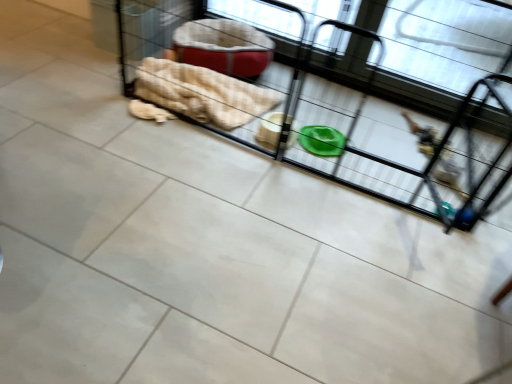
At what (x,y) coordinates should I click in order to perform the action: click on green plastic bowl at center. Please return your answer as a coordinate pair (x, y). This screenshot has height=384, width=512. Looking at the image, I should click on (351, 111).

Describe the element at coordinates (351, 111) in the screenshot. The width and height of the screenshot is (512, 384). I see `green plastic bowl at center` at that location.

The image size is (512, 384). I want to click on green plastic bowl at center, so click(x=351, y=111).